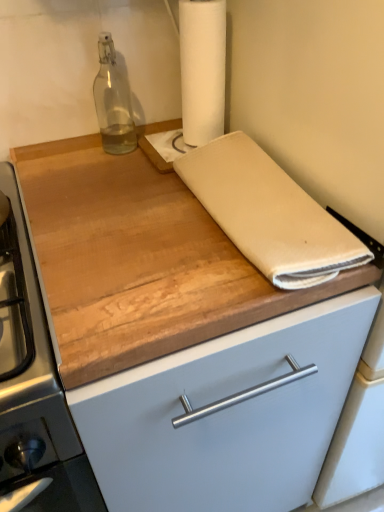
Question: Is white paper towel at upper center to the left of transparent glass bottle at upper left from the viewer's perspective?

Choices:
 (A) yes
 (B) no

Answer: (B)

Question: Considering the relative sizes of white paper towel at upper center and transparent glass bottle at upper left in the image provided, is white paper towel at upper center wider than transparent glass bottle at upper left?

Choices:
 (A) yes
 (B) no

Answer: (A)

Question: Is white paper towel at upper center oriented towards transparent glass bottle at upper left?

Choices:
 (A) yes
 (B) no

Answer: (B)

Question: Can we say white paper towel at upper center lies outside transparent glass bottle at upper left?

Choices:
 (A) yes
 (B) no

Answer: (A)

Question: Does white paper towel at upper center appear on the right side of transparent glass bottle at upper left?

Choices:
 (A) no
 (B) yes

Answer: (B)

Question: Would you say white paper towel at upper center is to the left or to the right of beige cotton towel at center in the picture?

Choices:
 (A) right
 (B) left

Answer: (B)

Question: Do you think white paper towel at upper center is within beige cotton towel at center, or outside of it?

Choices:
 (A) inside
 (B) outside

Answer: (B)

Question: Considering the positions of white paper towel at upper center and beige cotton towel at center in the image, is white paper towel at upper center taller or shorter than beige cotton towel at center?

Choices:
 (A) tall
 (B) short

Answer: (A)

Question: Is white paper towel at upper center wider or thinner than beige cotton towel at center?

Choices:
 (A) thin
 (B) wide

Answer: (A)

Question: Relative to transparent glass bottle at upper left, is beige cotton towel at center in front or behind?

Choices:
 (A) front
 (B) behind

Answer: (A)

Question: Would you say beige cotton towel at center is to the left or to the right of transparent glass bottle at upper left in the picture?

Choices:
 (A) left
 (B) right

Answer: (B)

Question: From a real-world perspective, is beige cotton towel at center physically located above or below transparent glass bottle at upper left?

Choices:
 (A) below
 (B) above

Answer: (A)

Question: From the image's perspective, relative to transparent glass bottle at upper left, is beige cotton towel at center above or below?

Choices:
 (A) above
 (B) below

Answer: (B)

Question: From the image's perspective, is transparent glass bottle at upper left above or below white paper towel at upper center?

Choices:
 (A) below
 (B) above

Answer: (A)

Question: Considering the relative positions of transparent glass bottle at upper left and white paper towel at upper center in the image provided, is transparent glass bottle at upper left to the left or to the right of white paper towel at upper center?

Choices:
 (A) left
 (B) right

Answer: (A)